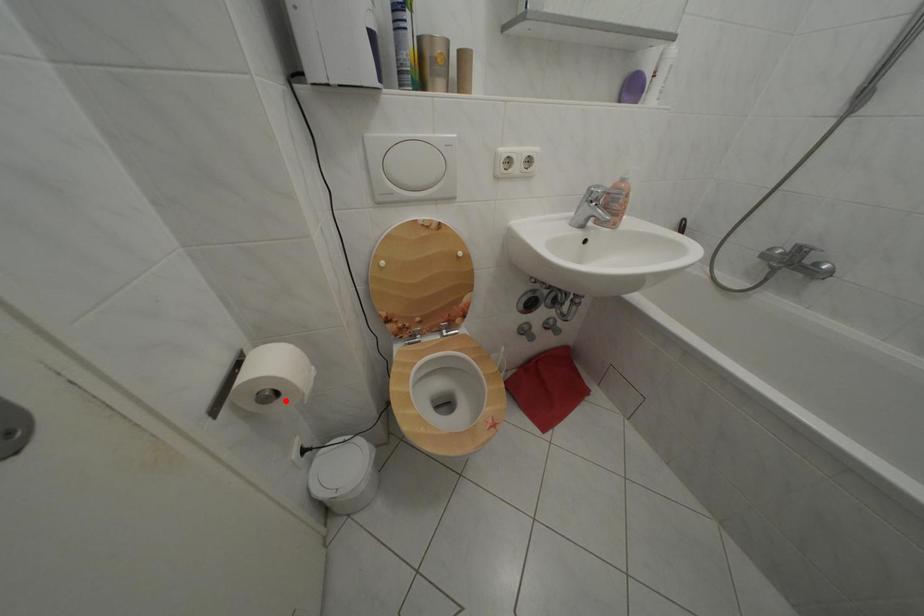
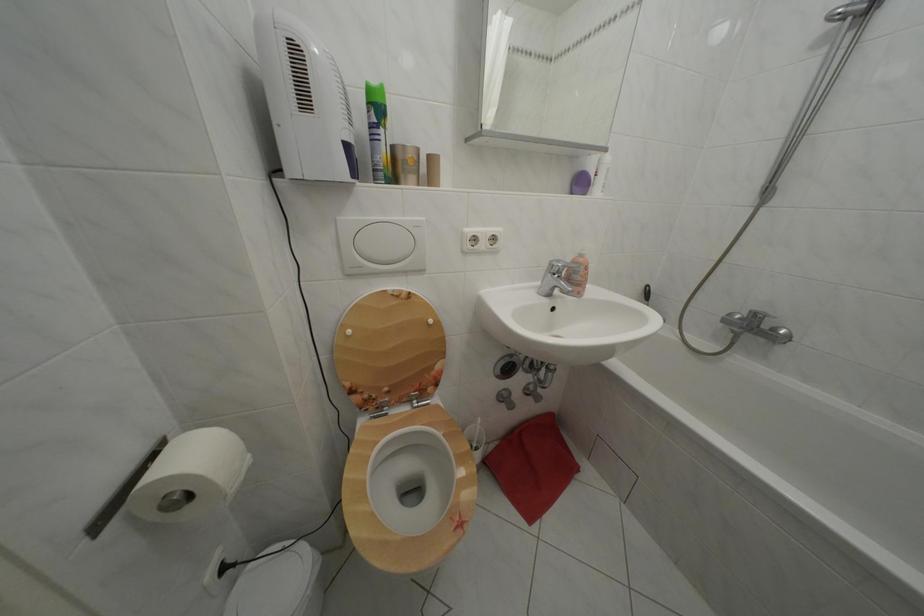
Where in the second image is the point corresponding to the highlighted location from the first image?

(198, 504)